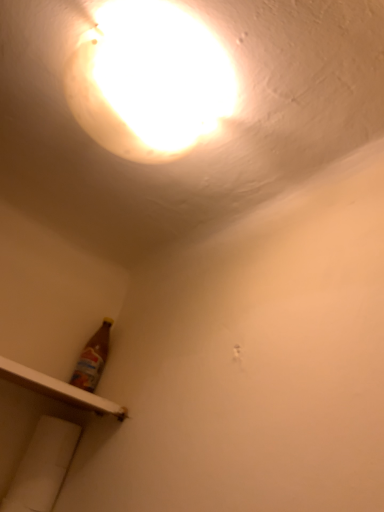
The width and height of the screenshot is (384, 512). Identify the location of white plastic shelf at lower left. (59, 389).

The height and width of the screenshot is (512, 384). What do you see at coordinates (59, 389) in the screenshot? I see `white plastic shelf at lower left` at bounding box center [59, 389].

What is the approximate height of matte white light at upper center?

matte white light at upper center is 3.54 inches tall.

Describe the element at coordinates (148, 81) in the screenshot. I see `matte white light at upper center` at that location.

Measure the distance between point [155,162] and camera.

A distance of 34.84 inches exists between point [155,162] and camera.

Where is `matte white light at upper center`? The width and height of the screenshot is (384, 512). matte white light at upper center is located at coordinates (148, 81).

The height and width of the screenshot is (512, 384). I want to click on white plastic shelf at lower left, so click(59, 389).

Is matte white light at upper center at the left side of white plastic shelf at lower left?

In fact, matte white light at upper center is to the right of white plastic shelf at lower left.

Is matte white light at upper center behind white plastic shelf at lower left?

That is False.

Considering the positions of point (112, 141) and point (70, 390), is point (112, 141) closer or farther from the camera than point (70, 390)?

Point (112, 141).

In the scene shown: From the image's perspective, between matte white light at upper center and white plastic shelf at lower left, which one is located above?

From the image's view, matte white light at upper center is above.

From a real-world perspective, which is physically below, matte white light at upper center or white plastic shelf at lower left?

From a 3D spatial view, white plastic shelf at lower left is below.

Is matte white light at upper center thinner than white plastic shelf at lower left?

Indeed, matte white light at upper center has a lesser width compared to white plastic shelf at lower left.

Considering the relative sizes of matte white light at upper center and white plastic shelf at lower left in the image provided, is matte white light at upper center shorter than white plastic shelf at lower left?

No, matte white light at upper center is not shorter than white plastic shelf at lower left.

Is matte white light at upper center bigger or smaller than white plastic shelf at lower left?

Considering their sizes, matte white light at upper center takes up more space than white plastic shelf at lower left.

Choose the correct answer: Is matte white light at upper center inside white plastic shelf at lower left or outside it?

matte white light at upper center is outside white plastic shelf at lower left.

Is matte white light at upper center far from white plastic shelf at lower left?

That's not correct — matte white light at upper center is a little close to white plastic shelf at lower left.

Is matte white light at upper center oriented towards white plastic shelf at lower left?

No, matte white light at upper center does not turn towards white plastic shelf at lower left.

Consider the image. Can you tell me how much matte white light at upper center and white plastic shelf at lower left differ in facing direction?

matte white light at upper center and white plastic shelf at lower left are facing 1.46 degrees away from each other.

Locate an element on the screen. This screenshot has height=512, width=384. lamp lying in front of the white plastic shelf at lower left is located at coordinates (148, 81).

From the picture: In the image, is white plastic shelf at lower left on the left side or the right side of matte white light at upper center?

white plastic shelf at lower left is to the left of matte white light at upper center.

Considering their positions, is white plastic shelf at lower left located in front of or behind matte white light at upper center?

In the image, white plastic shelf at lower left appears behind matte white light at upper center.

Is point (27, 375) more distant than point (158, 149)?

That is True.

From the image's perspective, which one is positioned lower, white plastic shelf at lower left or matte white light at upper center?

From the image's view, white plastic shelf at lower left is below.

From a real-world perspective, does white plastic shelf at lower left sit lower than matte white light at upper center?

Yes, from a real-world perspective, white plastic shelf at lower left is below matte white light at upper center.

Between white plastic shelf at lower left and matte white light at upper center, which one has smaller width?

matte white light at upper center.

From their relative heights in the image, would you say white plastic shelf at lower left is taller or shorter than matte white light at upper center?

Clearly, white plastic shelf at lower left is shorter compared to matte white light at upper center.

Looking at this image, does white plastic shelf at lower left have a smaller size compared to matte white light at upper center?

Yes.

Is white plastic shelf at lower left not inside matte white light at upper center?

Indeed, white plastic shelf at lower left is completely outside matte white light at upper center.

Would you consider white plastic shelf at lower left to be distant from matte white light at upper center?

No, white plastic shelf at lower left is not far from matte white light at upper center.

Is white plastic shelf at lower left facing towards matte white light at upper center?

No, white plastic shelf at lower left is not oriented towards matte white light at upper center.

The image size is (384, 512). In the image, there is a matte white light at upper center. Identify the location of shelf below it (from a real-world perspective). (59, 389).

Identify the location of shelf that appears below the matte white light at upper center (from the image's perspective). This screenshot has height=512, width=384. (59, 389).

Find the location of a particular element. The width and height of the screenshot is (384, 512). lamp located in front of the white plastic shelf at lower left is located at coordinates (148, 81).